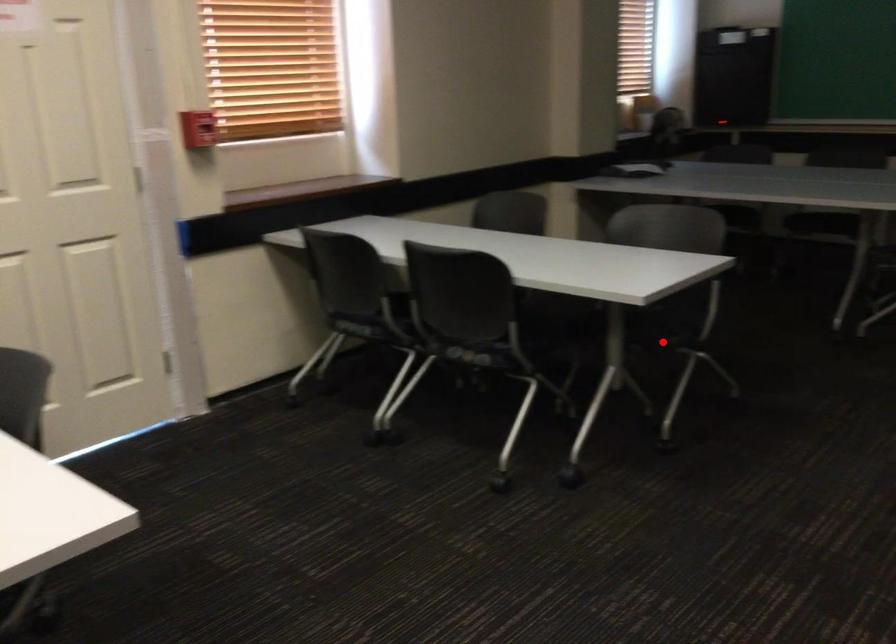
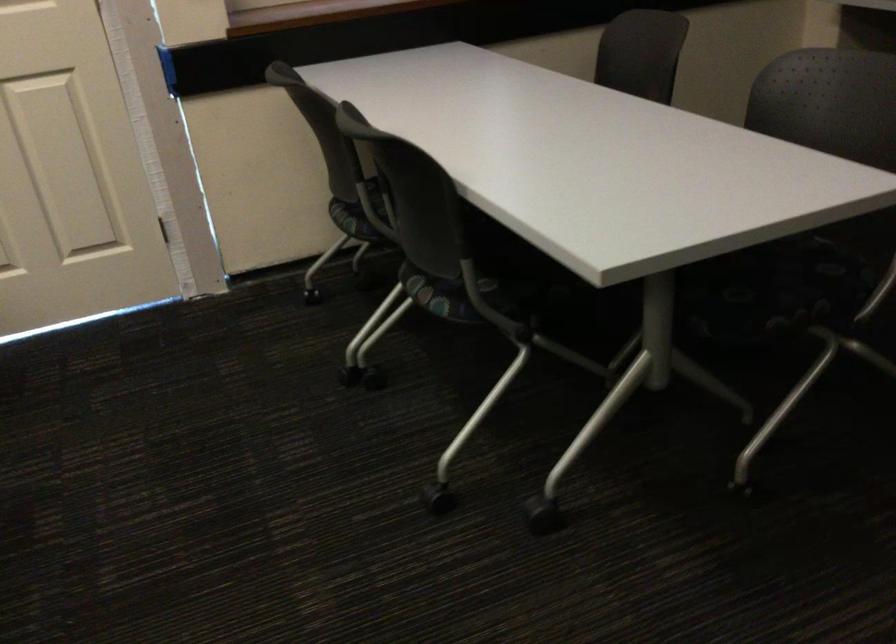
Question: I am providing you with two images of the same scene from different viewpoints. Image1 has a red point marked. In image2, the corresponding 3D location appears at what relative position? Reply with the corresponding letter.

Choices:
 (A) Closer
 (B) Farther

Answer: (A)